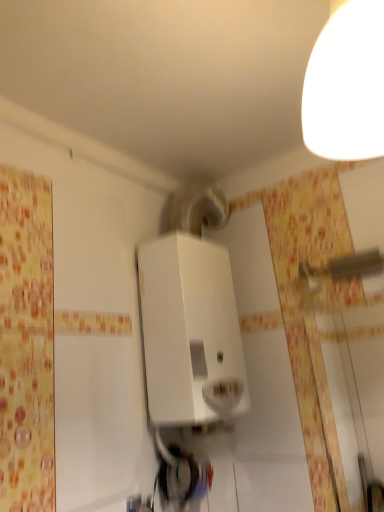
Question: Is white glossy lampshade at upper right taller or shorter than white matte water heater at center?

Choices:
 (A) short
 (B) tall

Answer: (A)

Question: Looking at their shapes, would you say white glossy lampshade at upper right is wider or thinner than white matte water heater at center?

Choices:
 (A) thin
 (B) wide

Answer: (B)

Question: From the image's perspective, relative to white matte water heater at center, is white glossy lampshade at upper right above or below?

Choices:
 (A) above
 (B) below

Answer: (A)

Question: Visually, is white matte water heater at center positioned to the left or to the right of white glossy lampshade at upper right?

Choices:
 (A) left
 (B) right

Answer: (A)

Question: Looking at their shapes, would you say white matte water heater at center is wider or thinner than white glossy lampshade at upper right?

Choices:
 (A) thin
 (B) wide

Answer: (A)

Question: From a real-world perspective, is white matte water heater at center above or below white glossy lampshade at upper right?

Choices:
 (A) above
 (B) below

Answer: (B)

Question: Considering the positions of point (193, 260) and point (372, 74), is point (193, 260) closer or farther from the camera than point (372, 74)?

Choices:
 (A) closer
 (B) farther

Answer: (B)